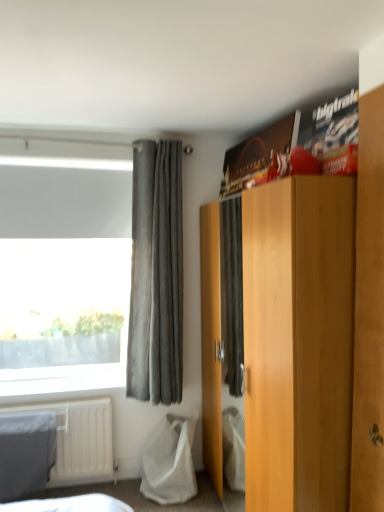
What do you see at coordinates (298, 342) in the screenshot? Image resolution: width=384 pixels, height=512 pixels. I see `light brown wood cabinet at center` at bounding box center [298, 342].

In the scene shown: What is the approximate width of light brown wood cabinet at center?

light brown wood cabinet at center is 25.31 inches wide.

In order to face gray cotton blanket at lower left, should I rotate leftwards or rightwards?

A 20.888 degree turn to the left will do.

The width and height of the screenshot is (384, 512). I want to click on gray cotton blanket at lower left, so click(26, 453).

Where is `gray suede curtain at left`? The height and width of the screenshot is (512, 384). gray suede curtain at left is located at coordinates (156, 275).

The image size is (384, 512). Describe the element at coordinates (156, 275) in the screenshot. I see `gray suede curtain at left` at that location.

Where is `light brown wood cabinet at center`? The width and height of the screenshot is (384, 512). light brown wood cabinet at center is located at coordinates pos(298,342).

Is white mesh bag at lower left taller or shorter than gray cotton blanket at lower left?

In the image, white mesh bag at lower left appears to be shorter than gray cotton blanket at lower left.

Is white mesh bag at lower left positioned with its back to gray cotton blanket at lower left?

white mesh bag at lower left is not turned away from gray cotton blanket at lower left.

Does white mesh bag at lower left have a lesser width compared to gray cotton blanket at lower left?

In fact, white mesh bag at lower left might be wider than gray cotton blanket at lower left.

Can you confirm if white mesh bag at lower left is positioned to the left of gray cotton blanket at lower left?

No.

From a real-world perspective, who is located lower, gray suede curtain at left or brown wooden wardrobe at upper right?

From a 3D spatial view, brown wooden wardrobe at upper right is below.

From the image's perspective, which is below, gray suede curtain at left or brown wooden wardrobe at upper right?

brown wooden wardrobe at upper right, from the image's perspective.

Considering the positions of objects gray suede curtain at left and brown wooden wardrobe at upper right in the image provided, who is behind, gray suede curtain at left or brown wooden wardrobe at upper right?

gray suede curtain at left is behind.

Measure the distance from gray suede curtain at left to brown wooden wardrobe at upper right.

The distance of gray suede curtain at left from brown wooden wardrobe at upper right is 5.06 feet.

Considering the sizes of objects brown wooden wardrobe at upper right and gray cotton blanket at lower left in the image provided, who is taller, brown wooden wardrobe at upper right or gray cotton blanket at lower left?

Standing taller between the two is brown wooden wardrobe at upper right.

In the scene shown: How many degrees apart are the facing directions of brown wooden wardrobe at upper right and gray cotton blanket at lower left?

There is a 92.9-degree angle between the facing directions of brown wooden wardrobe at upper right and gray cotton blanket at lower left.

Considering their positions, is brown wooden wardrobe at upper right located in front of or behind gray cotton blanket at lower left?

Visually, brown wooden wardrobe at upper right is located in front of gray cotton blanket at lower left.

Where is `blanket below the brown wooden wardrobe at upper right (from the image's perspective)`? This screenshot has width=384, height=512. blanket below the brown wooden wardrobe at upper right (from the image's perspective) is located at coordinates (26, 453).

Is gray cotton blanket at lower left in front of or behind gray suede curtain at left in the image?

gray cotton blanket at lower left is positioned closer to the viewer than gray suede curtain at left.

Looking at this image, how much distance is there between gray cotton blanket at lower left and gray suede curtain at left?

A distance of 36.80 inches exists between gray cotton blanket at lower left and gray suede curtain at left.

Can you confirm if gray cotton blanket at lower left is smaller than gray suede curtain at left?

Correct, gray cotton blanket at lower left occupies less space than gray suede curtain at left.

From the image's perspective, which one is positioned lower, gray cotton blanket at lower left or gray suede curtain at left?

From the image's view, gray cotton blanket at lower left is below.

Is gray cotton blanket at lower left thinner than brown wooden wardrobe at upper right?

Incorrect, the width of gray cotton blanket at lower left is not less than that of brown wooden wardrobe at upper right.

Considering the sizes of objects gray cotton blanket at lower left and brown wooden wardrobe at upper right in the image provided, who is bigger, gray cotton blanket at lower left or brown wooden wardrobe at upper right?

gray cotton blanket at lower left.

Is gray cotton blanket at lower left touching brown wooden wardrobe at upper right?

No, gray cotton blanket at lower left is not beside brown wooden wardrobe at upper right.

Considering the relative sizes of gray suede curtain at left and white mesh bag at lower left in the image provided, is gray suede curtain at left taller than white mesh bag at lower left?

Correct, gray suede curtain at left is much taller as white mesh bag at lower left.

Which is correct: gray suede curtain at left is inside white mesh bag at lower left, or outside of it?

gray suede curtain at left exists outside the volume of white mesh bag at lower left.

Considering the points (180, 142) and (163, 463), which point is behind, point (180, 142) or point (163, 463)?

Positioned behind is point (180, 142).

Is gray suede curtain at left bigger than white mesh bag at lower left?

Yes, gray suede curtain at left is bigger than white mesh bag at lower left.

Is light brown wood cabinet at center not within white mesh bag at lower left?

Yes, light brown wood cabinet at center is outside of white mesh bag at lower left.

Is light brown wood cabinet at center turned away from white mesh bag at lower left?

No, light brown wood cabinet at center's orientation is not away from white mesh bag at lower left.

Considering the relative positions of light brown wood cabinet at center and white mesh bag at lower left in the image provided, is light brown wood cabinet at center to the left of white mesh bag at lower left from the viewer's perspective?

No.

Identify the location of sheet below the gray cotton blanket at lower left (from the image's perspective). (x=169, y=461).

You are a GUI agent. You are given a task and a screenshot of the screen. Output one action in this format:
    pyautogui.click(x=<x>, y=<y>)
    Task: Click on the curtain above the brown wooden wardrobe at upper right (from the image's perspective)
    The width and height of the screenshot is (384, 512).
    Given the screenshot: What is the action you would take?
    pyautogui.click(x=156, y=275)

When comparing their distances from brown wooden wardrobe at upper right, does gray cotton blanket at lower left or light brown wood cabinet at center seem closer?

Among the two, light brown wood cabinet at center is located nearer to brown wooden wardrobe at upper right.

Considering their positions, is light brown wood cabinet at center positioned closer to brown wooden wardrobe at upper right than gray suede curtain at left?

light brown wood cabinet at center is positioned closer to the anchor brown wooden wardrobe at upper right.

Which object lies further to the anchor point gray suede curtain at left, brown wooden wardrobe at upper right or light brown wood cabinet at center?

Among the two, brown wooden wardrobe at upper right is located further to gray suede curtain at left.

Considering their positions, is white mesh bag at lower left positioned further to gray cotton blanket at lower left than brown wooden wardrobe at upper right?

brown wooden wardrobe at upper right is positioned further to the anchor gray cotton blanket at lower left.

Considering their positions, is white mesh bag at lower left positioned closer to brown wooden wardrobe at upper right than light brown wood cabinet at center?

light brown wood cabinet at center.

When comparing their distances from white mesh bag at lower left, does light brown wood cabinet at center or gray suede curtain at left seem closer?

The object closer to white mesh bag at lower left is gray suede curtain at left.

Estimate the real-world distances between objects in this image. Which object is closer to gray cotton blanket at lower left, light brown wood cabinet at center or white mesh bag at lower left?

Among the two, white mesh bag at lower left is located nearer to gray cotton blanket at lower left.

Looking at the image, which one is located further to white mesh bag at lower left, gray cotton blanket at lower left or gray suede curtain at left?

gray cotton blanket at lower left.

Locate an element on the screen. The height and width of the screenshot is (512, 384). curtain located between gray cotton blanket at lower left and brown wooden wardrobe at upper right in the left-right direction is located at coordinates (156, 275).

At what (x,y) coordinates should I click in order to perform the action: click on curtain between gray cotton blanket at lower left and light brown wood cabinet at center. Please return your answer as a coordinate pair (x, y). The image size is (384, 512). Looking at the image, I should click on (156, 275).

Locate an element on the screen. The width and height of the screenshot is (384, 512). sheet located between gray cotton blanket at lower left and brown wooden wardrobe at upper right in the left-right direction is located at coordinates (169, 461).

This screenshot has height=512, width=384. In order to click on cabinetry situated between gray cotton blanket at lower left and brown wooden wardrobe at upper right from left to right in this screenshot , I will do `click(298, 342)`.